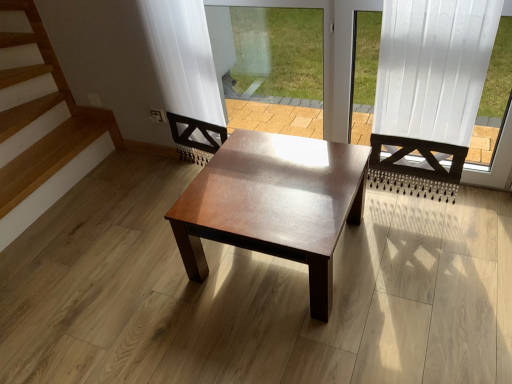
At what (x,y) coordinates should I click in order to perform the action: click on vacant point to the right of shiny brown wood coffee table at center. Please return your answer as a coordinate pair (x, y). This screenshot has height=384, width=512. Looking at the image, I should click on (426, 257).